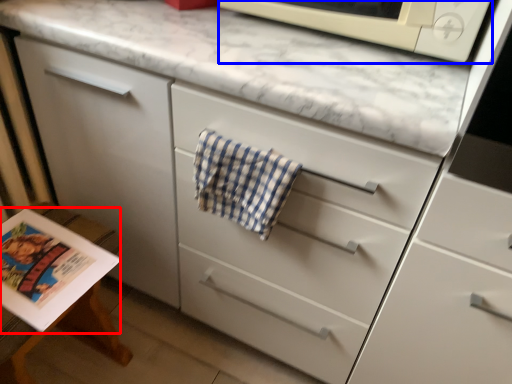
Question: Which object appears closest to the camera in this image, magazine (highlighted by a red box) or microwave oven (highlighted by a blue box)?

Choices:
 (A) magazine
 (B) microwave oven

Answer: (B)